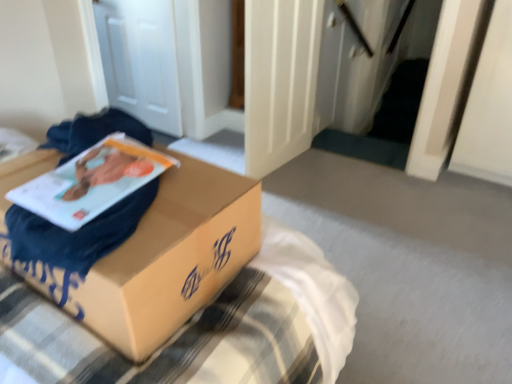
Question: Would you say matte cardboard box at center is inside or outside matte paper at center?

Choices:
 (A) outside
 (B) inside

Answer: (A)

Question: From the image's perspective, is matte cardboard box at center located above or below matte paper at center?

Choices:
 (A) below
 (B) above

Answer: (A)

Question: From a real-world perspective, is matte cardboard box at center above or below matte paper at center?

Choices:
 (A) above
 (B) below

Answer: (B)

Question: Which is correct: matte paper at center is inside matte cardboard box at center, or outside of it?

Choices:
 (A) outside
 (B) inside

Answer: (B)

Question: In terms of size, does matte paper at center appear bigger or smaller than matte cardboard box at center?

Choices:
 (A) small
 (B) big

Answer: (A)

Question: Is matte paper at center taller or shorter than matte cardboard box at center?

Choices:
 (A) short
 (B) tall

Answer: (A)

Question: In the image, is matte paper at center on the left side or the right side of matte cardboard box at center?

Choices:
 (A) right
 (B) left

Answer: (B)